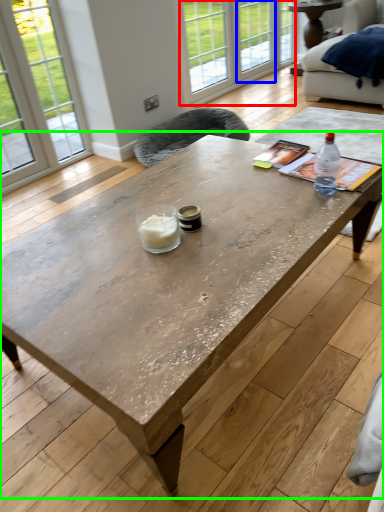
Question: Estimate the real-world distances between objects in this image. Which object is closer to glass door (highlighted by a red box), window (highlighted by a blue box) or coffee table (highlighted by a green box)?

Choices:
 (A) window
 (B) coffee table

Answer: (A)